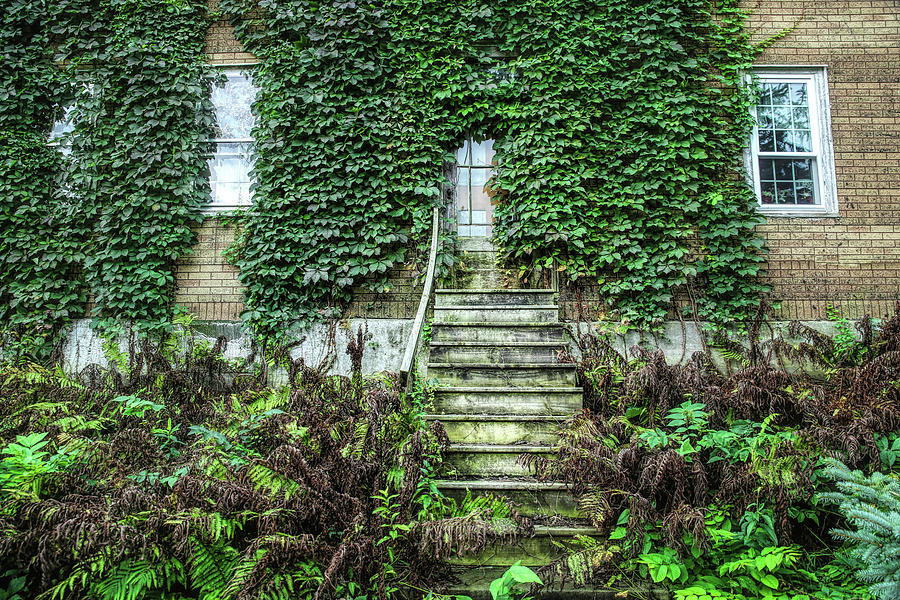
Identify the location of grey wood steps. The width and height of the screenshot is (900, 600). (549, 547), (531, 485), (523, 447), (522, 418).